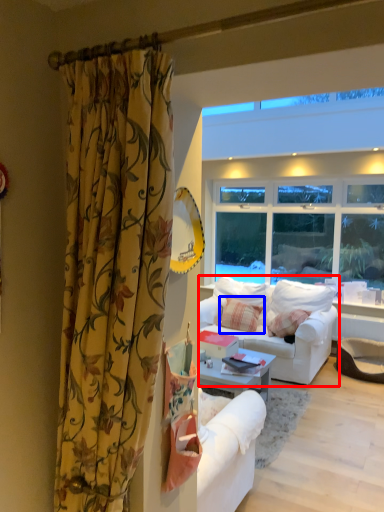
Question: Which point is further to the camera, studio couch (highlighted by a red box) or pillow (highlighted by a blue box)?

Choices:
 (A) studio couch
 (B) pillow

Answer: (B)